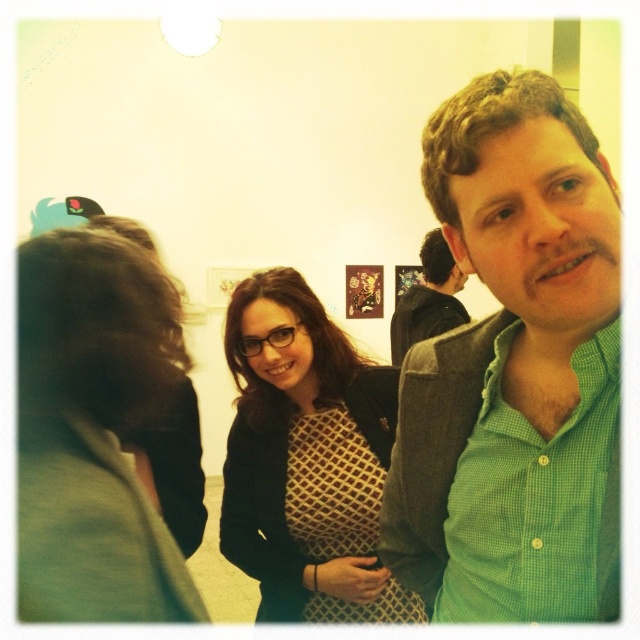
You are standing in the center of the room and want to greet the dark brown hair at left. In which direction should you move to approach them?

You should move to the left to approach the dark brown hair at left since they are located at point [93,432], which is to the left side of the room.

You are at a social gathering and want to introduce yourself to the person wearing the green checkered shirt at right. Which direction should you move to approach them from the dark brown hair at left?

Since the dark brown hair at left is positioned under the green checkered shirt at right, you should move to the right and upwards to approach the person wearing the green checkered shirt at right from the dark brown hair at left.

You are standing in the gallery and want to take a photo of the matte black blazer at center without the dark brown hair at left blocking it. How should you adjust your position?

Move to the right side so that the dark brown hair at left is no longer in front of the matte black blazer at center.